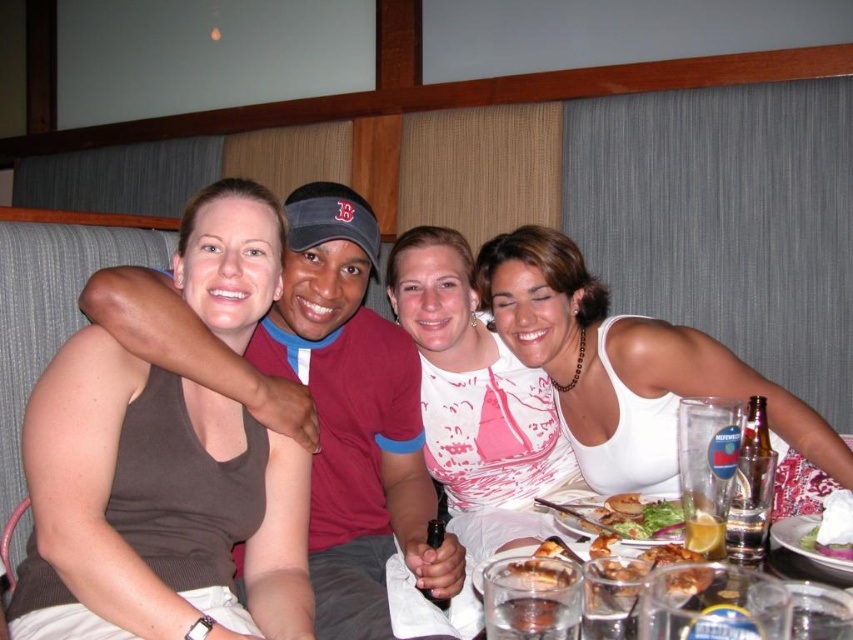
Question: Which object is closer to the camera taking this photo?

Choices:
 (A) golden crispy fries at center
 (B) smooth white cream at lower right

Answer: (B)

Question: Is the position of maroon fabric shirt at center less distant than that of clear glass water at lower right?

Choices:
 (A) yes
 (B) no

Answer: (B)

Question: Can you confirm if pink fabric shirt at center is bigger than smooth white cream at lower right?

Choices:
 (A) yes
 (B) no

Answer: (A)

Question: Can you confirm if pink fabric shirt at center is bigger than golden crispy fries at center?

Choices:
 (A) yes
 (B) no

Answer: (A)

Question: Based on their relative distances, which object is nearer to the maroon fabric shirt at center?

Choices:
 (A) golden crispy fries at center
 (B) smooth white cream at lower right
 (C) pink fabric shirt at center

Answer: (C)

Question: Which point is farther to the camera?

Choices:
 (A) (628, 534)
 (B) (421, 259)

Answer: (B)